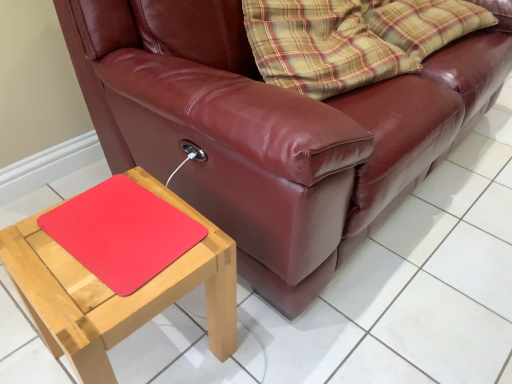
This screenshot has height=384, width=512. In order to click on vacant point above rubberized red mouse pad at lower left (from a real-world perspective) in this screenshot , I will do `click(124, 222)`.